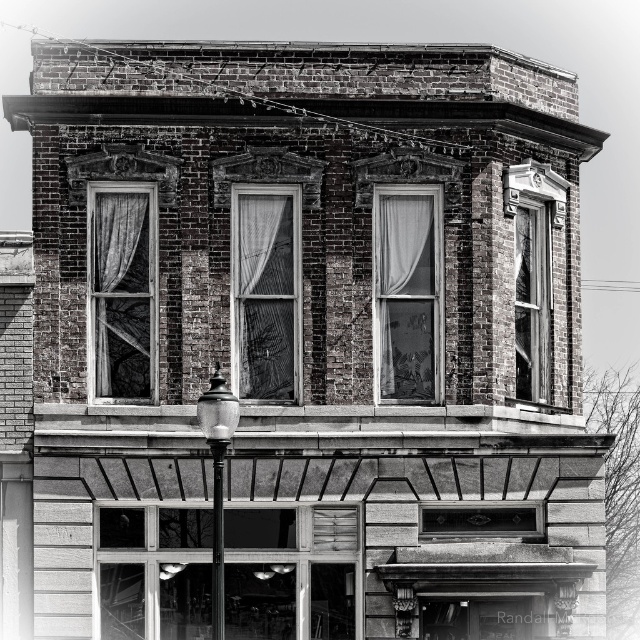
You are an architect analyzing the symmetry of the building in the image. The clear glass window at upper right and the transparent glass window at upper right are both part of the upper level. Which of these two windows has a larger height measurement?

The clear glass window at upper right has a greater height compared to the transparent glass window at upper right, so the clear glass window at upper right is taller.

You are standing in front of the two story brick building shown in the image. You need to determine if you can see the clear glass window at upper right from your current position. The camera is at your eye level. Can you see it?

The clear glass window at upper right is 160.91 feet away from the camera. Since the camera is at your eye level, you can see the clear glass window at upper right from your current position as there is no obstruction mentioned in the scene description.